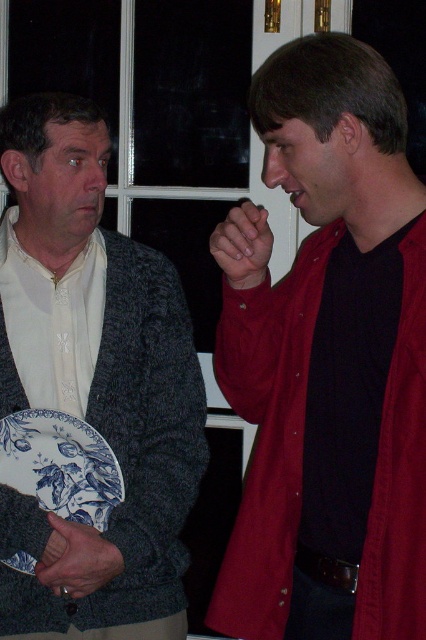
You are a delivery person trying to place two packages at specific coordinates in the room. The first package must be placed at point (72, 240) and the second at point (49, 483). According to the scene, which package location is closer to the window with white frames?

Point (49, 483) is closer to the window with white frames because point (72, 240) is behind it, meaning it is further away from the window.

You are a photographer setting up a shoot in the scene described. You need to ensure that the matte red shirt at center and the blue printed platter at left are both visible in the frame. Given their relative heights, which object should be placed lower in the composition to maintain balance?

The blue printed platter at left should be placed lower in the composition because the matte red shirt at center has a greater height, so lowering the shorter object helps balance the visual weight.